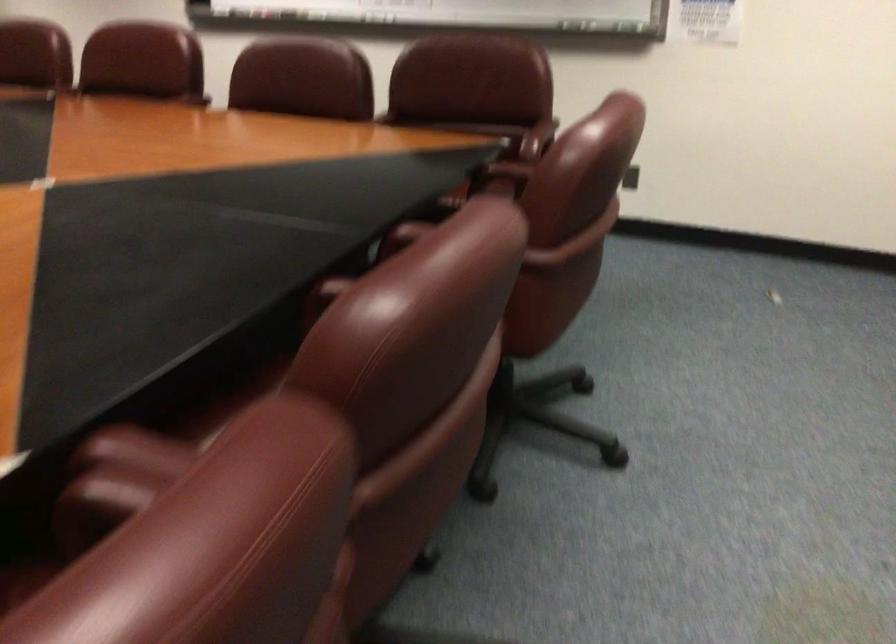
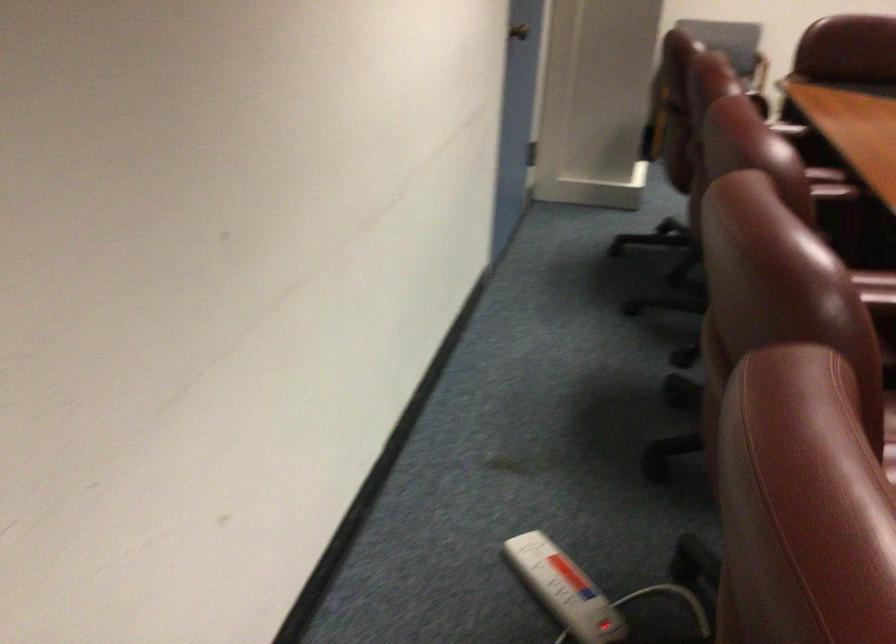
Question: Which direction would the cameraman need to move to produce the second image? Reply with the corresponding letter.

Choices:
 (A) Left
 (B) Right
 (C) Forward
 (D) Backward

Answer: (D)